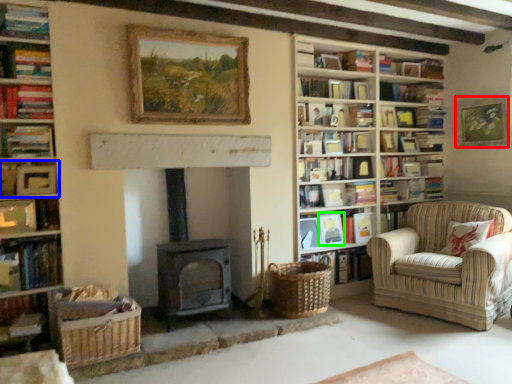
Question: Which is farther away from picture frame (highlighted by a red box)? book (highlighted by a blue box) or picture frame (highlighted by a green box)?

Choices:
 (A) book
 (B) picture frame

Answer: (A)